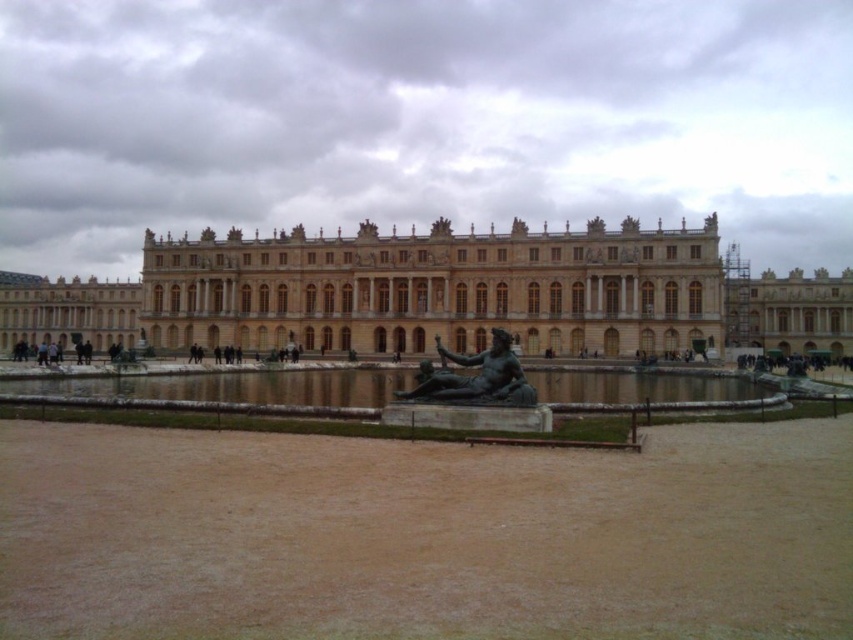
Question: Is golden stone palace at center smaller than bronze statue at center?

Choices:
 (A) yes
 (B) no

Answer: (B)

Question: Which object is the closest to the dark brown leather person at lower left?

Choices:
 (A) golden stone palace at center
 (B) bronze statue at center
 (C) clear water at fountain center

Answer: (C)

Question: Which of the following is the farthest from the observer?

Choices:
 (A) (561, 291)
 (B) (39, 356)
 (C) (462, 385)
 (D) (221, 374)

Answer: (B)

Question: Does clear water at fountain center appear on the right side of bronze statue at center?

Choices:
 (A) no
 (B) yes

Answer: (A)

Question: Estimate the real-world distances between objects in this image. Which object is farther from the bronze statue at center?

Choices:
 (A) clear water at fountain center
 (B) dark brown leather person at lower left

Answer: (B)

Question: Can you confirm if golden stone palace at center is positioned above clear water at fountain center?

Choices:
 (A) no
 (B) yes

Answer: (B)